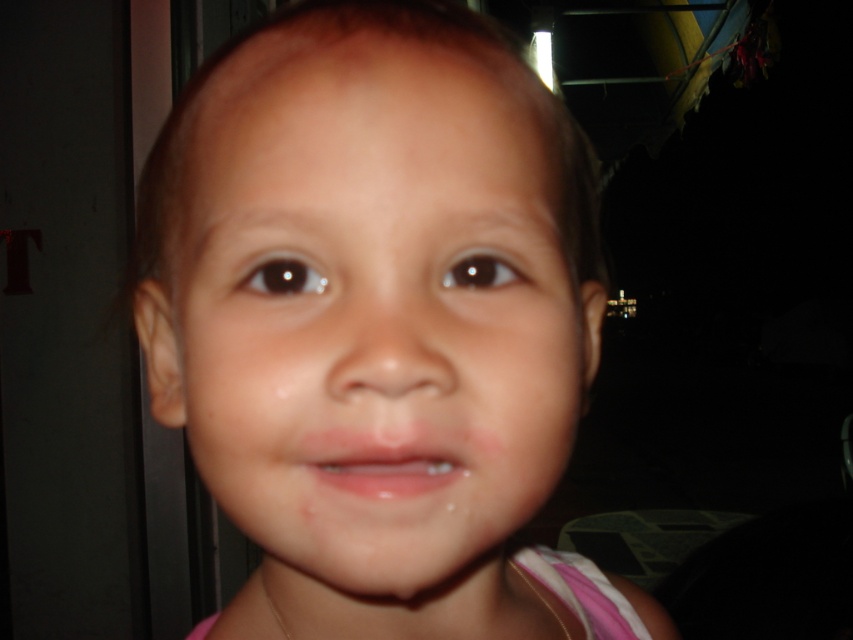
Question: Can you confirm if smooth skin face at center is positioned above glossy pink lips at center?

Choices:
 (A) yes
 (B) no

Answer: (A)

Question: Does smooth skin face at center appear over glossy pink lips at center?

Choices:
 (A) yes
 (B) no

Answer: (A)

Question: Which of the following is the farthest from the observer?

Choices:
 (A) glossy pink lips at center
 (B) smooth skin face at center

Answer: (A)

Question: Does smooth skin face at center have a larger size compared to glossy pink lips at center?

Choices:
 (A) yes
 (B) no

Answer: (A)